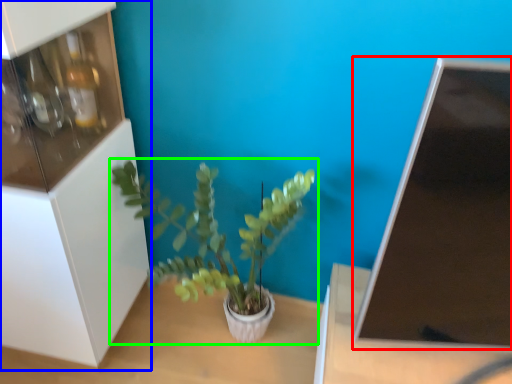
Question: Which object is positioned farthest from computer monitor (highlighted by a red box)? Select from shelf (highlighted by a blue box) and houseplant (highlighted by a green box).

Choices:
 (A) shelf
 (B) houseplant

Answer: (A)